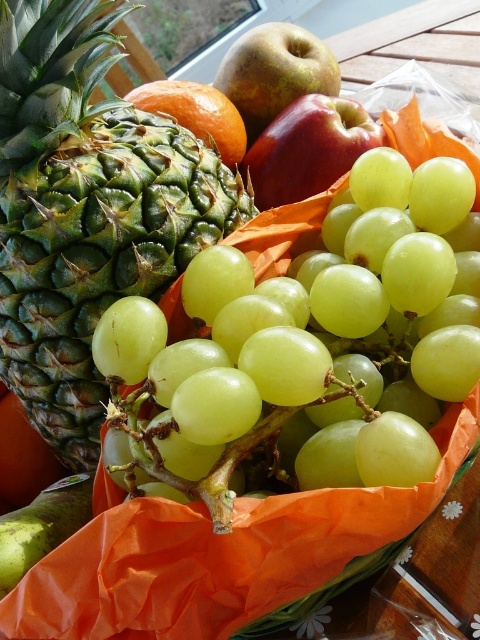
You are arranging fruits on a small table. You have the green matte grapes at center and the green textured pineapple at upper left. Which fruit takes up more space on the table?

The green textured pineapple at upper left takes up more space on the table than the green matte grapes at center because it occupies more space according to the description.

You are standing at the point labeled as point (309, 348) in the image. Which fruit is directly in front of you?

The green matte grapes at center are directly in front of you at point (309, 348).